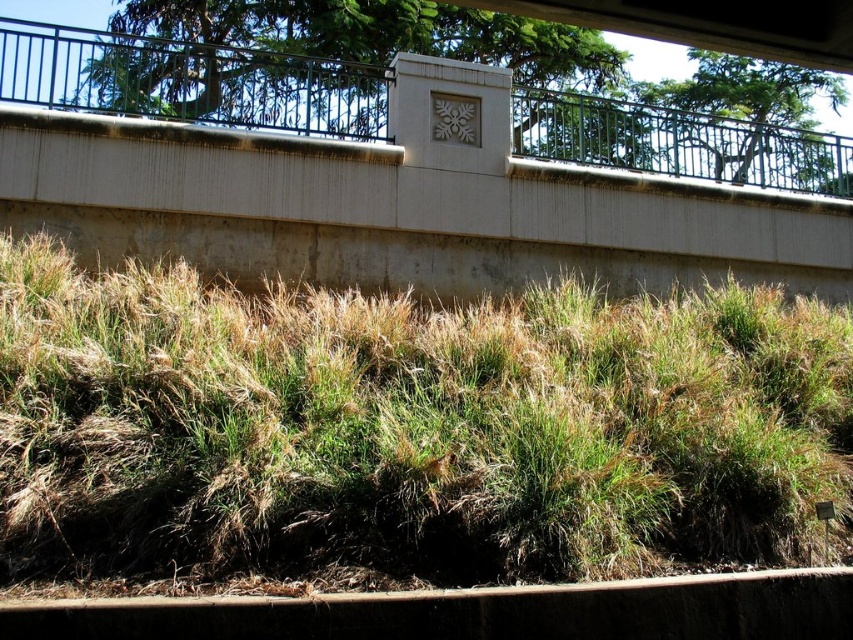
Question: Considering the relative positions of green grassy at center and concrete at center in the image provided, where is green grassy at center located with respect to concrete at center?

Choices:
 (A) right
 (B) left

Answer: (A)

Question: In this image, where is green grassy at center located relative to concrete at center?

Choices:
 (A) right
 (B) left

Answer: (A)

Question: Which point is farther to the camera?

Choices:
 (A) green grassy at center
 (B) concrete at center

Answer: (B)

Question: Which point is closer to the camera taking this photo?

Choices:
 (A) (566, 353)
 (B) (61, 164)

Answer: (A)

Question: Can you confirm if green grassy at center is smaller than concrete at center?

Choices:
 (A) no
 (B) yes

Answer: (A)